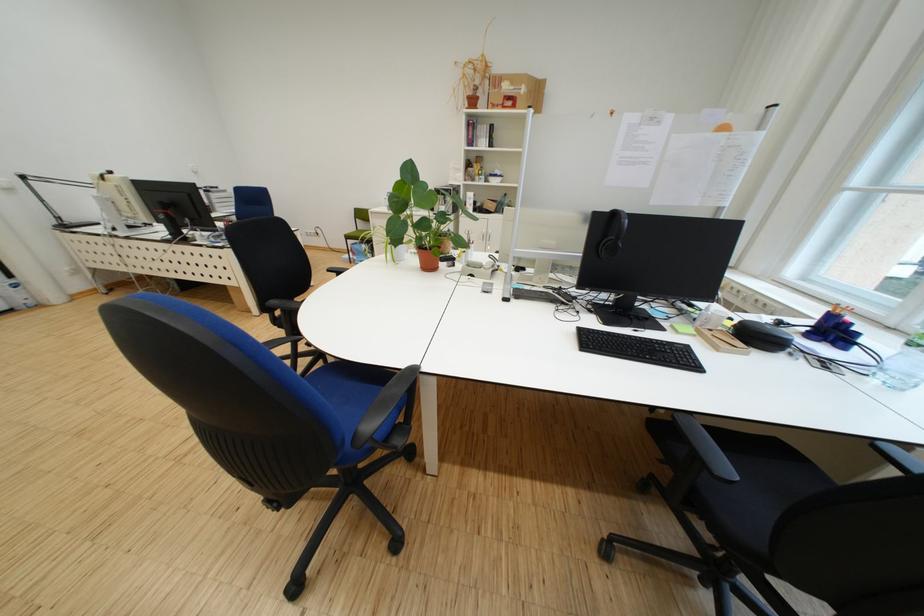
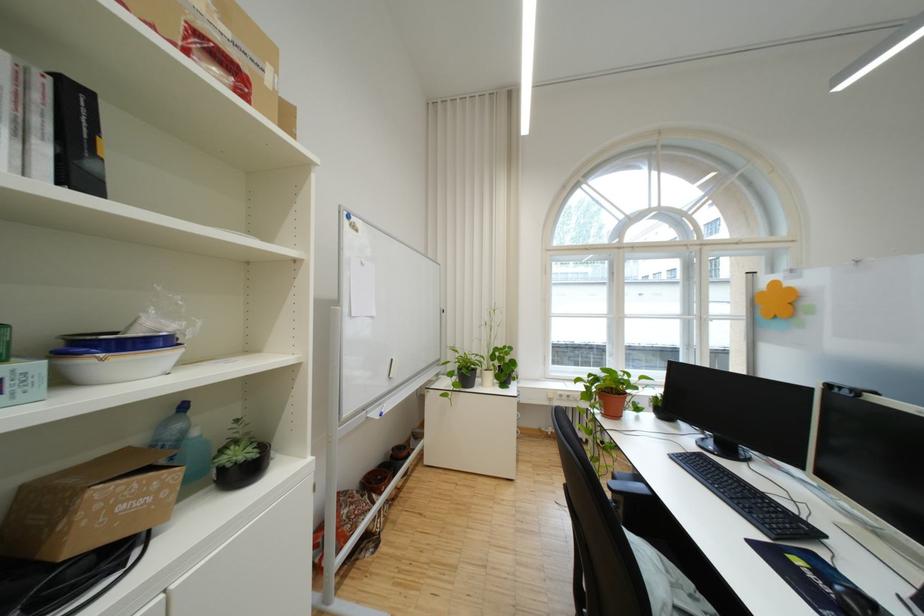
The point at [503,180] is marked in the first image. Where is the corresponding point in the second image?

(117, 365)